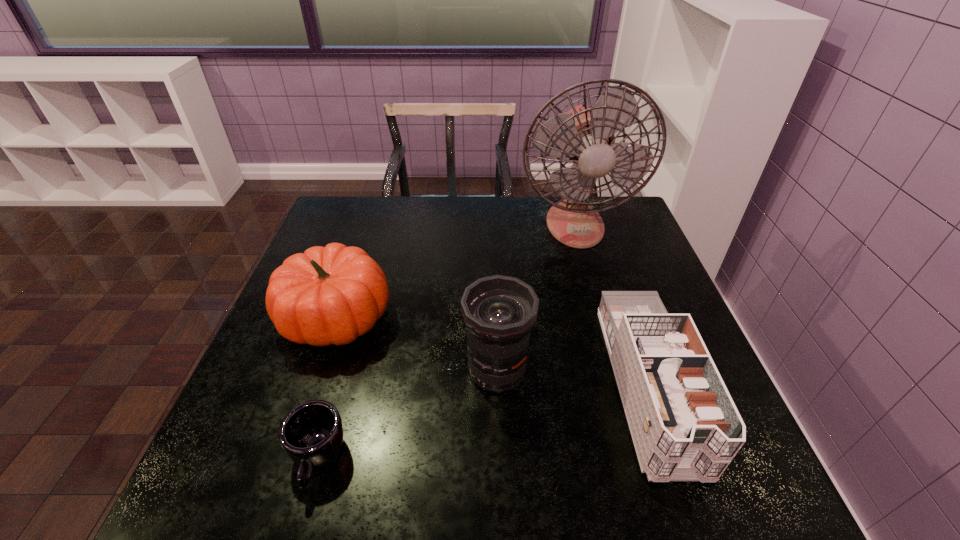
Find the location of `the tallest object`. the tallest object is located at coordinates (585, 134).

Where is `fan`? fan is located at coordinates (585, 134).

I want to click on telephoto lens, so click(x=499, y=312).

Locate an element on the screen. The image size is (960, 540). pumpkin is located at coordinates (328, 295).

Where is `dollhouse`? The height and width of the screenshot is (540, 960). dollhouse is located at coordinates (684, 424).

Identify the location of the shortest object. The height and width of the screenshot is (540, 960). (311, 434).

The height and width of the screenshot is (540, 960). What are the coordinates of `vacant area situated in front of the tallest object to direct airflow` in the screenshot? It's located at (612, 356).

The image size is (960, 540). What are the coordinates of `vacant space located 0.280m on the left of the telephoto lens` in the screenshot? It's located at (330, 370).

Locate an element on the screen. The width and height of the screenshot is (960, 540). vacant space located 0.230m on the front of the pumpkin is located at coordinates (288, 463).

Locate an element on the screen. Image resolution: width=960 pixels, height=540 pixels. object present at the far edge is located at coordinates (585, 134).